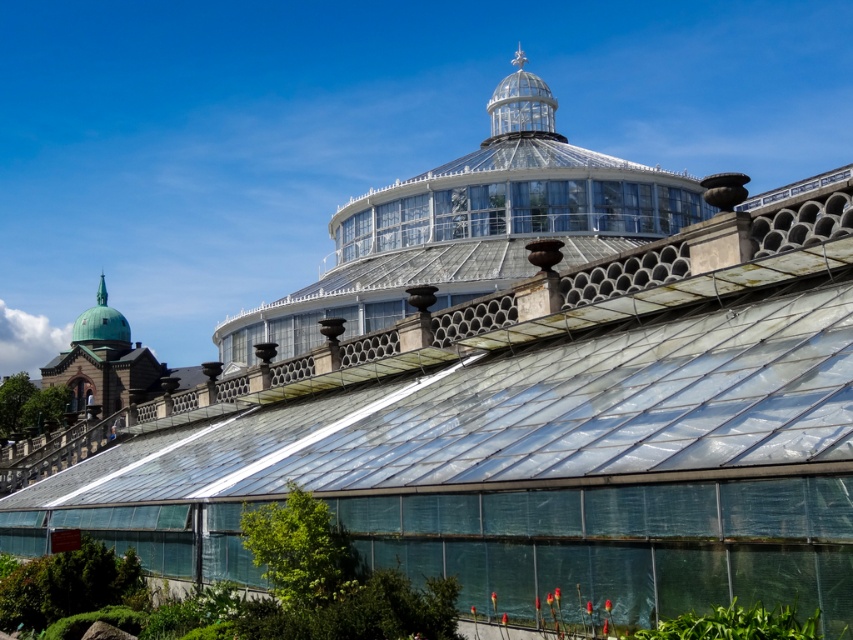
You are standing in the greenhouse and notice two points marked on the structure. The first point is located at coordinates point [631,573] and the second at point [105,321]. Based on your position, which point is nearer to you?

Point [631,573] is closer to the camera than point [105,321], so the first point is nearer to you.

Looking at this image, you are a visitor standing at the entrance of the greenhouse. You see the transparent glass dome at center and the transparent plastic garden at lower center. Which structure is higher from the ground?

The transparent glass dome at center is much taller than the transparent plastic garden at lower center, so the transparent glass dome at center is higher from the ground.